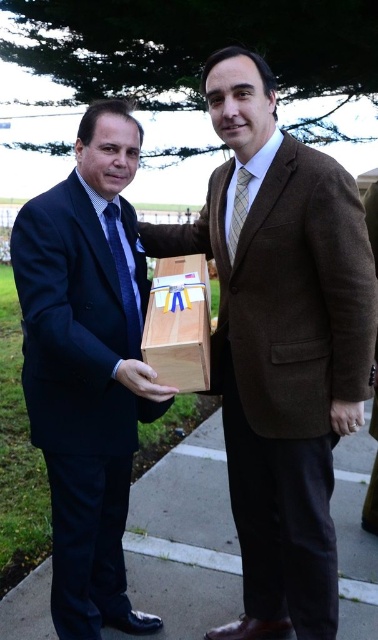
You are a photographer standing at the camera position. You want to place a 2.5 meters long banner between you and the point at point [167,275]. Will the banner fit without overlapping the point?

The distance between the camera and point [167,275] is 2.26 meters. Since the banner is 2.5 meters long, it will extend beyond the point, meaning it will overlap the point.

You are a photographer at a park event. You need to take a photo of the brown woolen suit at center and the gold metallic ring at lower right. Based on their positions, which object should you focus on first to ensure both are in frame?

The brown woolen suit at center is above the gold metallic ring at lower right, so you should focus on the brown woolen suit at center first to ensure both are in frame.

You are a photographer positioned at the origin point. The matte wood box at center is at coordinates 0.572, 0.228. If you want to take a photo of the box without including the man on the right, which direction should you move your camera?

The matte wood box at center is located at point (86, 365). To avoid including the man on the right, move the camera to the left since the box is positioned centrally and the man is on the right side of the image.